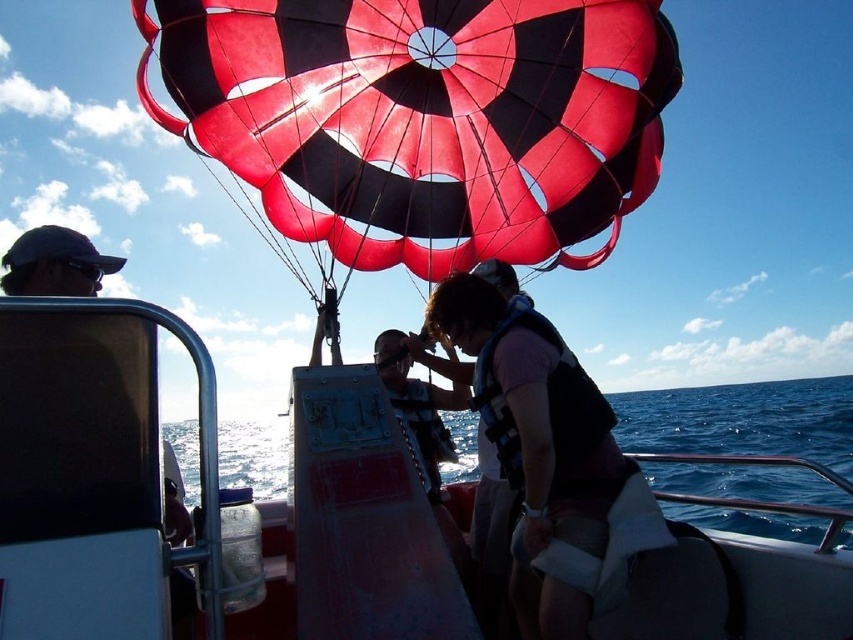
Question: Where is metallic red boat at center located in relation to blue water at center in the image?

Choices:
 (A) left
 (B) right

Answer: (A)

Question: Is blue water at center bigger than matte pink life vest at center?

Choices:
 (A) no
 (B) yes

Answer: (B)

Question: From the image, what is the correct spatial relationship of blue water at center in relation to matte pink life vest at center?

Choices:
 (A) above
 (B) below

Answer: (B)

Question: Which is nearer to the metallic red boat at center?

Choices:
 (A) blue water at center
 (B) matte pink life vest at center

Answer: (B)

Question: Which object appears farthest from the camera in this image?

Choices:
 (A) metallic red boat at center
 (B) blue water at center

Answer: (B)

Question: Which point is closer to the camera taking this photo?

Choices:
 (A) (751, 390)
 (B) (459, 278)

Answer: (B)